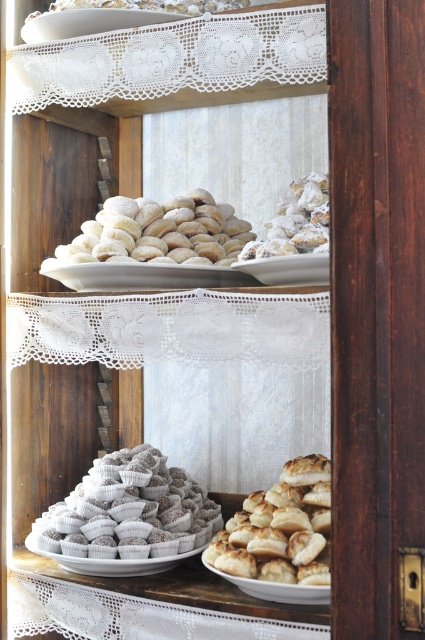
Is the position of white powdered sugar-coated pastries at center more distant than that of white porcelain plate at center?

Yes, white powdered sugar-coated pastries at center is behind white porcelain plate at center.

Between white powdered sugar-coated pastries at center and white porcelain plate at center, which one is positioned higher?

white porcelain plate at center

Between point (192, 516) and point (263, 268), which one is positioned behind?

The point (192, 516) is behind.

I want to click on white powdered sugar-coated pastries at center, so click(130, 509).

Consider the image. Who is more distant from viewer, (84, 244) or (300, 257)?

The point (84, 244) is more distant.

Based on the photo, which is more to the left, powdery white cookies at center or white porcelain plate at center?

powdery white cookies at center is more to the left.

What are the coordinates of `powdery white cookies at center` in the screenshot? It's located at (159, 230).

Between point (300, 579) and point (121, 566), which one is positioned behind?

The point (121, 566) is more distant.

Does point (289, 508) come farther from viewer compared to point (186, 556)?

No, it is not.

Identify the location of golden brown flaky pastry at lower center. This screenshot has width=425, height=640. (280, 529).